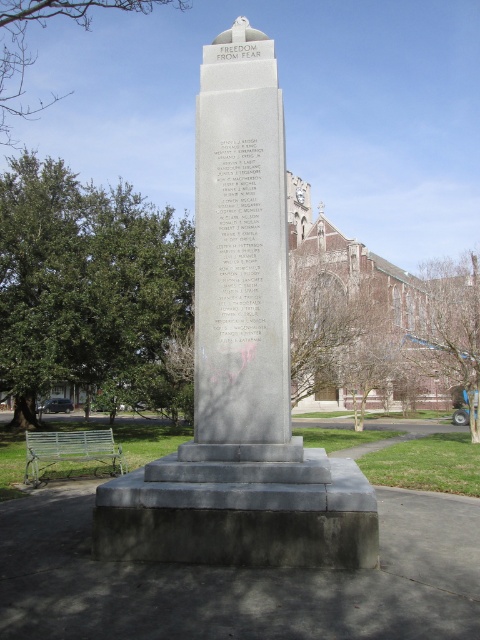
You are a landscape architect designing a new garden around the monument. You need to place a small statue exactly halfway between the gray stone monument at center and the gray polished stone monument at center. Which monument will the statue be closer to?

The statue will be closer to the gray polished stone monument at center because it is wider than the gray stone monument at center, so the halfway point would be nearer to the wider monument.

You are standing at the entrance of the park and want to find the gray stone monument at center. According to the map, your current position is at point 0.500, 0.500. In which direction should you move to reach the monument?

The gray stone monument at center is located at point (x=240, y=365), so you should move to the right from your current position at (x=240, y=320) to reach it.

Wait, the objects list has two entries that are almost the same. Let me check the input again. The user provided two objects with very similar labels. The first is gray stone monument at center, and the second is gray polished stone monument at center. The difference is the word polished in the second one. The objects description says the first is smaller than the second. Hmm, so the question must mention both objects as given. Since the user might have intended to have two distinct objects, even though the

The gray stone monument at center is smaller in size compared to the gray polished stone monument at center.